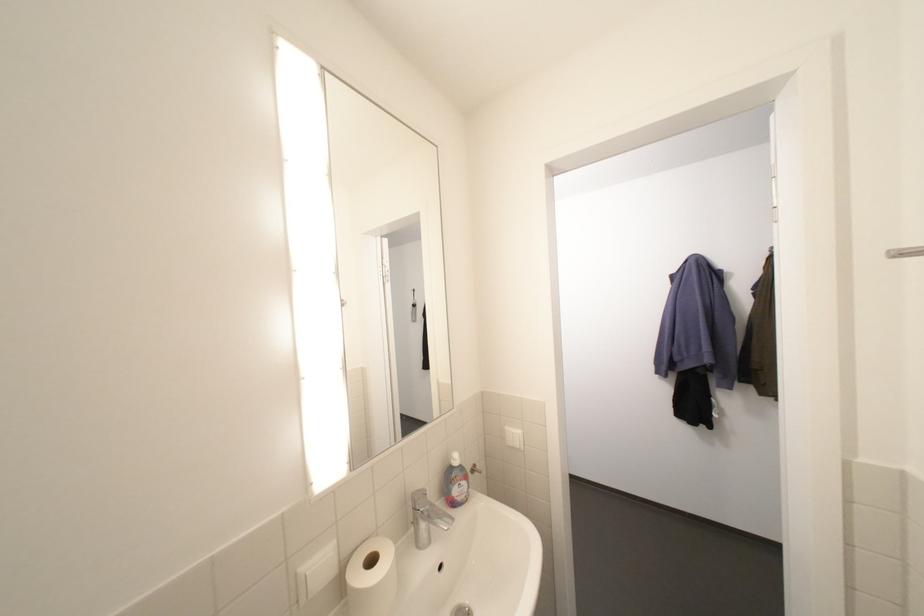
This screenshot has width=924, height=616. What do you see at coordinates (371, 578) in the screenshot?
I see `the white toilet paper` at bounding box center [371, 578].